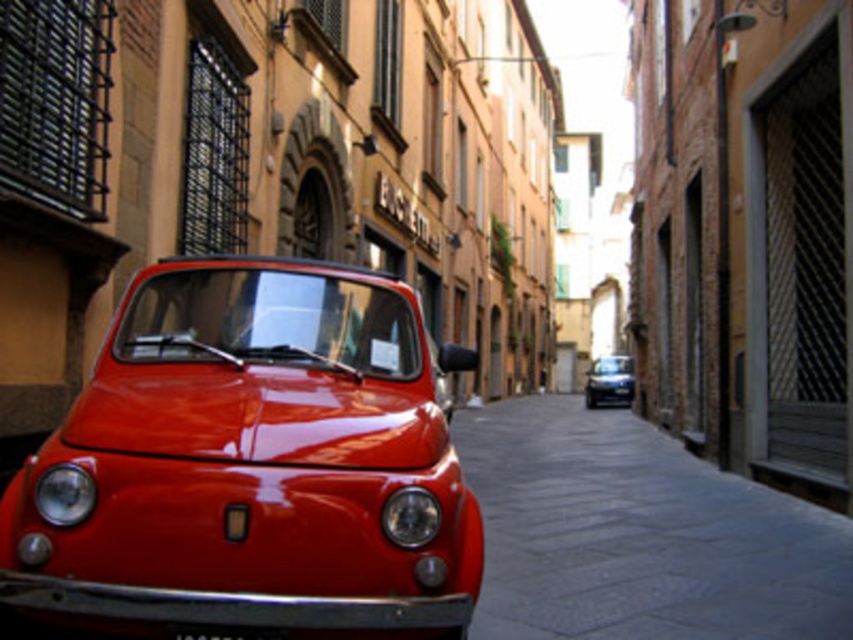
You are a photographer aiming to capture the entire dark gray stone alley at center and the black plastic license plate at center in a single shot. Considering their sizes, will you need to adjust your camera angle to ensure both are fully visible?

The dark gray stone alley at center is much taller than the black plastic license plate at center, so you will need to adjust your camera angle to ensure both are fully visible.

You are a delivery person trying to attach a package to the glossy red car at center. The package must be placed below the black plastic license plate at center. Can you place it there?

The glossy red car at center is above the black plastic license plate at center, so yes, the package can be placed below the black plastic license plate at center.

Looking at this image, you are a pedestrian standing on the street and want to read the license plate of the glossy red car at center. Can you see the black plastic license plate at center from your current position?

The black plastic license plate at center is behind the glossy red car at center, so it is not visible from the pedestrian standing on the street.